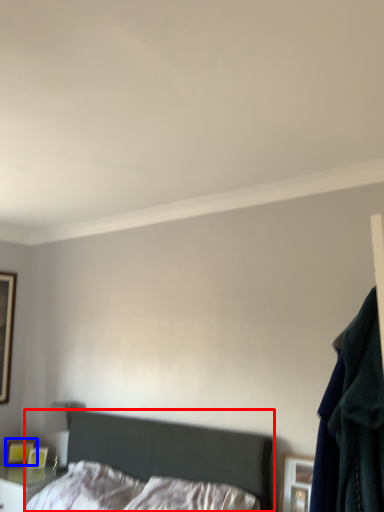
Question: Which point is closer to the camera, bed (highlighted by a red box) or picture frame (highlighted by a blue box)?

Choices:
 (A) bed
 (B) picture frame

Answer: (A)